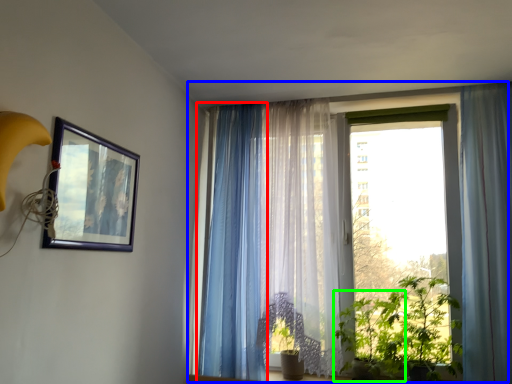
Question: Which is farther away from curtain (highlighted by a red box)? window (highlighted by a blue box) or plant (highlighted by a green box)?

Choices:
 (A) window
 (B) plant

Answer: (A)